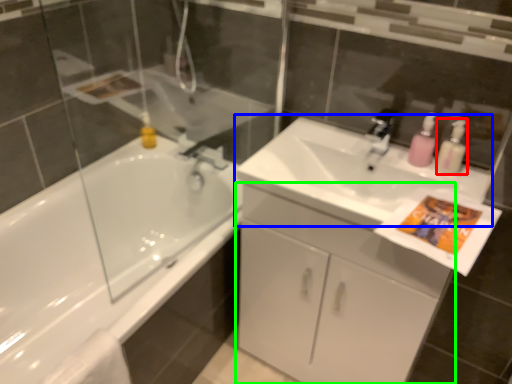
Question: Which is farther away from cleaning product (highlighted by a red box)? sink (highlighted by a blue box) or bathroom cabinet (highlighted by a green box)?

Choices:
 (A) sink
 (B) bathroom cabinet

Answer: (B)